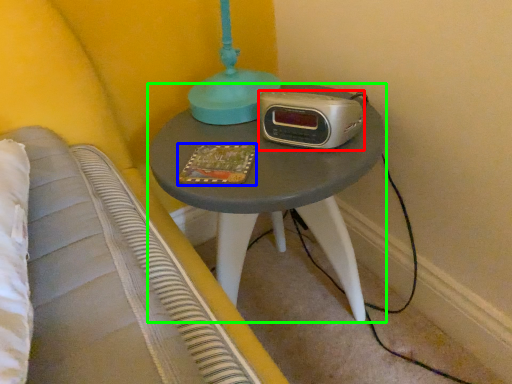
Question: Considering the real-world distances, which object is farthest from stereo (highlighted by a red box)? book (highlighted by a blue box) or nightstand (highlighted by a green box)?

Choices:
 (A) book
 (B) nightstand

Answer: (B)